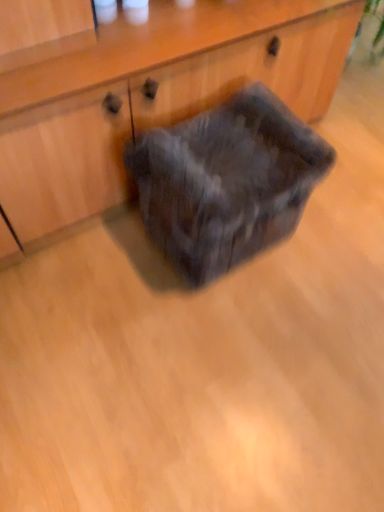
The image size is (384, 512). I want to click on blank space to the left of textured gray fabric chair at center, so click(x=98, y=261).